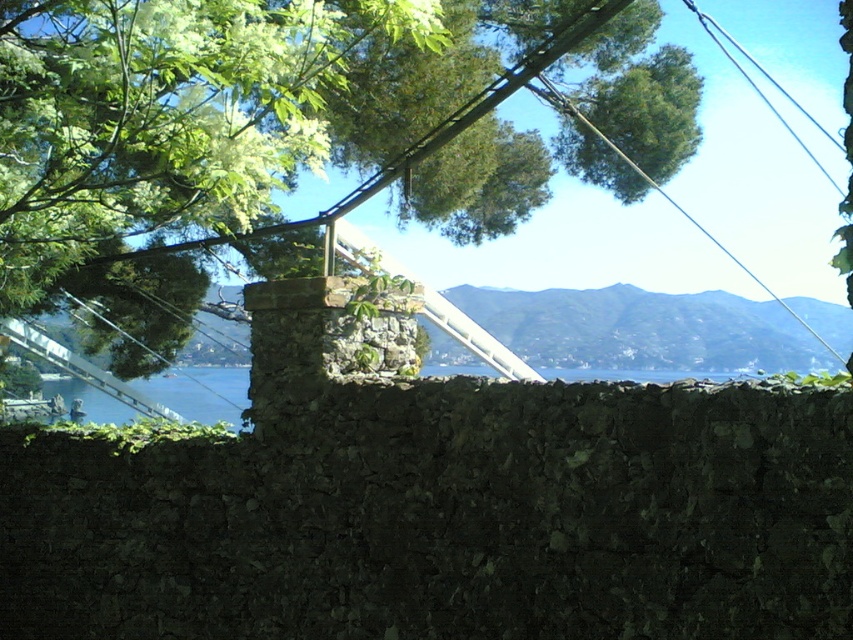
Question: Can you confirm if green leafy tree at upper left is positioned above black wire at upper right?

Choices:
 (A) yes
 (B) no

Answer: (B)

Question: Which point is closer to the camera?

Choices:
 (A) [x=375, y=92]
 (B) [x=834, y=186]

Answer: (A)

Question: Is the position of green leafy tree at upper left more distant than that of black wire at upper right?

Choices:
 (A) yes
 (B) no

Answer: (B)

Question: Among these points, which one is farthest from the camera?

Choices:
 (A) (619, 36)
 (B) (691, 10)

Answer: (B)

Question: Is green leafy tree at upper left to the left of black wire at upper right from the viewer's perspective?

Choices:
 (A) no
 (B) yes

Answer: (B)